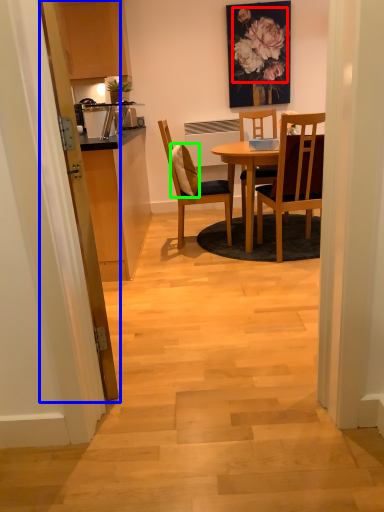
Question: Which is nearer to the flower (highlighted by a red box)? glass door (highlighted by a blue box) or pillow (highlighted by a green box).

Choices:
 (A) glass door
 (B) pillow

Answer: (B)